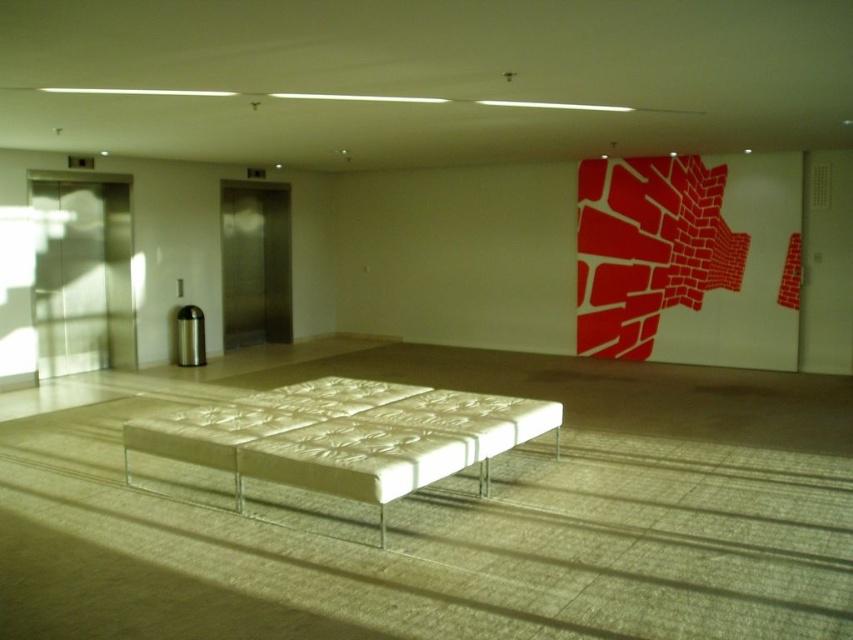
You are standing in the lobby and need to find the white textured bench at center. According to the layout, where should you look relative to the red mural on the right wall?

The white textured bench at center is located at point coordinates, which places it in the central area of the room. Since the red mural is on the right wall, the bench is positioned to the left of the mural when viewed from the entrance.